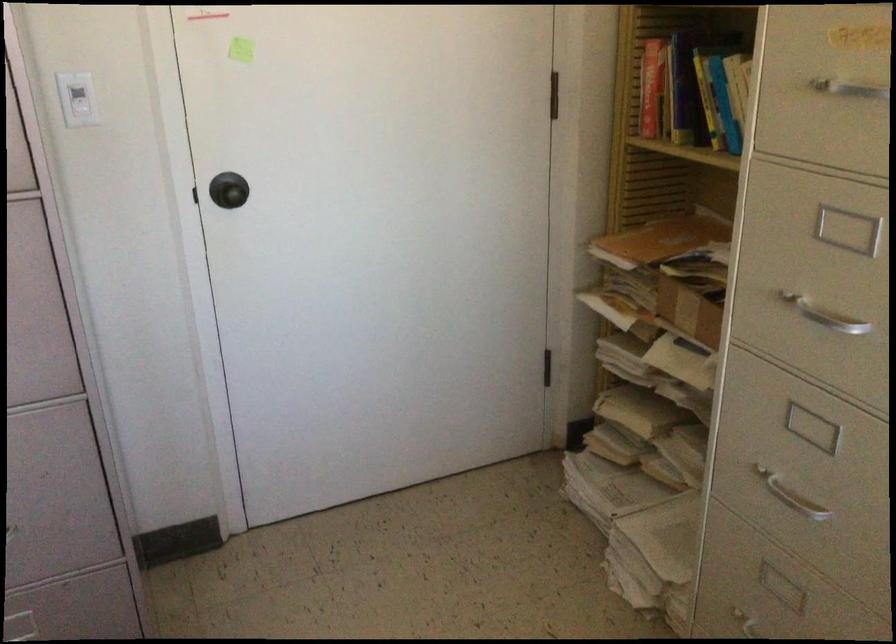
This screenshot has width=896, height=644. What are the coordinates of `white light switch` in the screenshot? It's located at (76, 99).